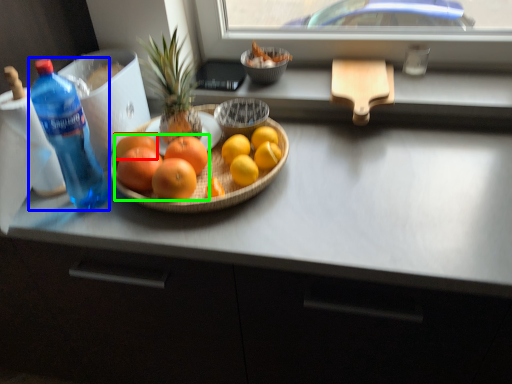
Question: Which is nearer to the grapefruit (highlighted by a red box)? bottle (highlighted by a blue box) or grapefruit (highlighted by a green box).

Choices:
 (A) bottle
 (B) grapefruit

Answer: (B)